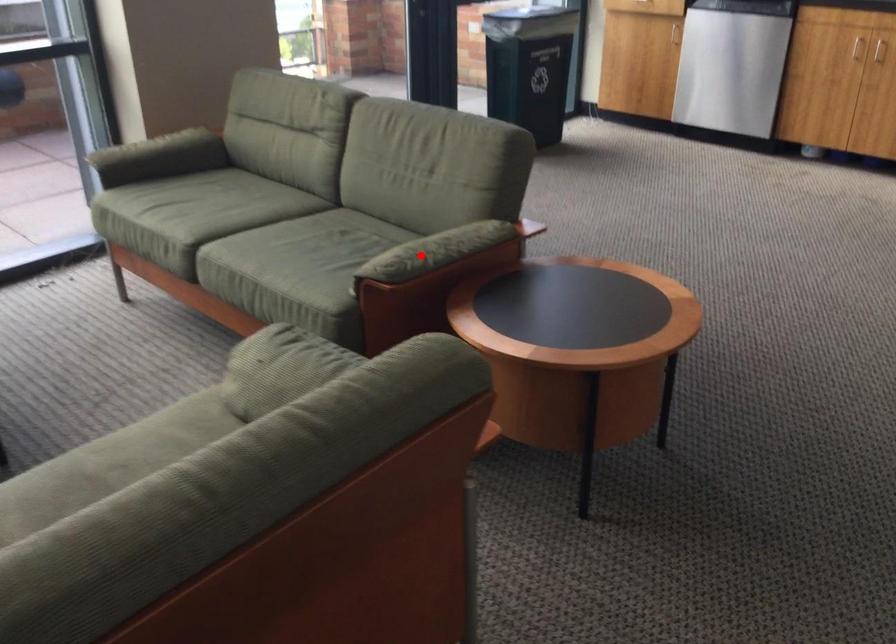
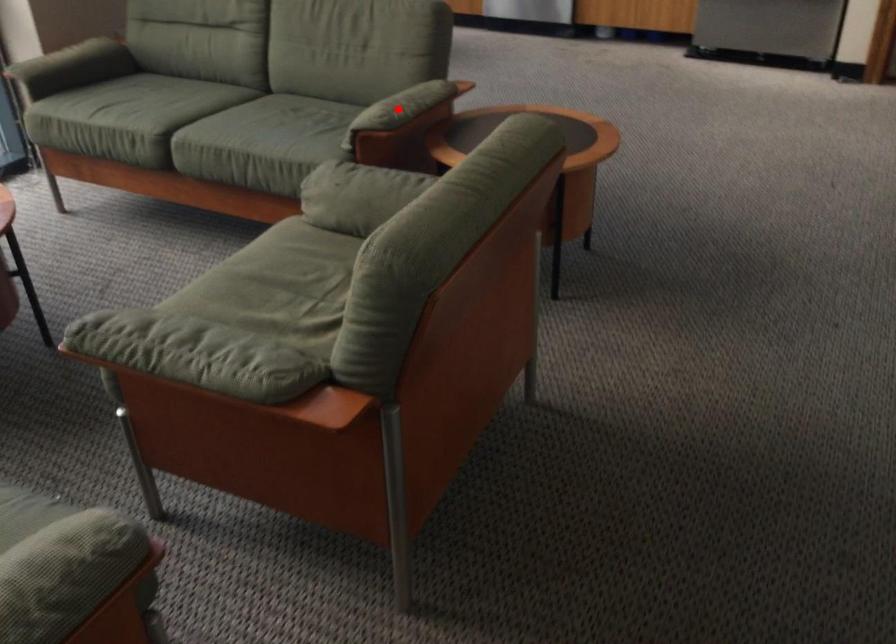
I am providing you with two images of the same scene from different viewpoints. A red point is marked on the first image and another point is marked on the second image. Do the highlighted points in image1 and image2 indicate the same real-world spot?

Yes